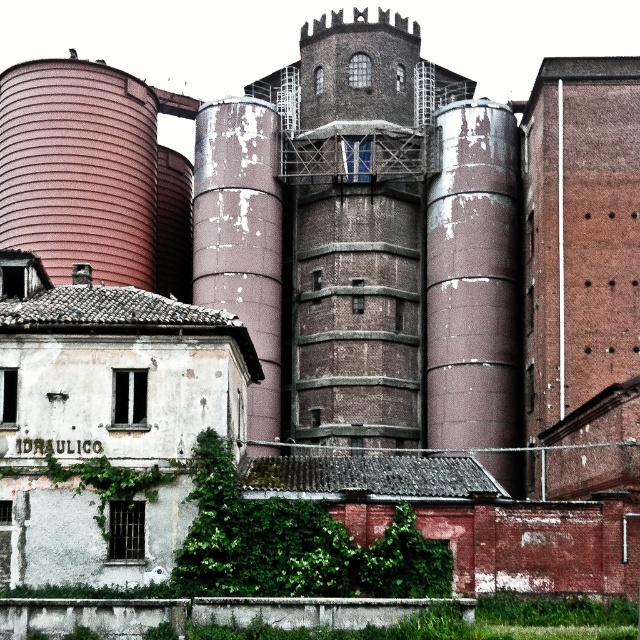
Can you confirm if green leafy plant at lower center is positioned to the right of green ivy at lower left?

Correct, you'll find green leafy plant at lower center to the right of green ivy at lower left.

Is green leafy plant at lower center further to the viewer compared to green ivy at lower left?

No, it is not.

This screenshot has width=640, height=640. I want to click on green leafy plant at lower center, so click(294, 545).

This screenshot has height=640, width=640. I want to click on green leafy plant at lower center, so click(x=294, y=545).

Identify the location of green leafy plant at lower center. This screenshot has width=640, height=640. (294, 545).

I want to click on green leafy plant at lower center, so click(x=294, y=545).

This screenshot has height=640, width=640. Identify the location of green leafy plant at lower center. (294, 545).

Does rusty metal silo at center appear over green ivy at lower left?

Indeed, rusty metal silo at center is positioned over green ivy at lower left.

Between point (266, 310) and point (131, 493), which one is positioned in front?

Point (131, 493) is more forward.

Where is `rusty metal silo at center`? Image resolution: width=640 pixels, height=640 pixels. rusty metal silo at center is located at coordinates (241, 240).